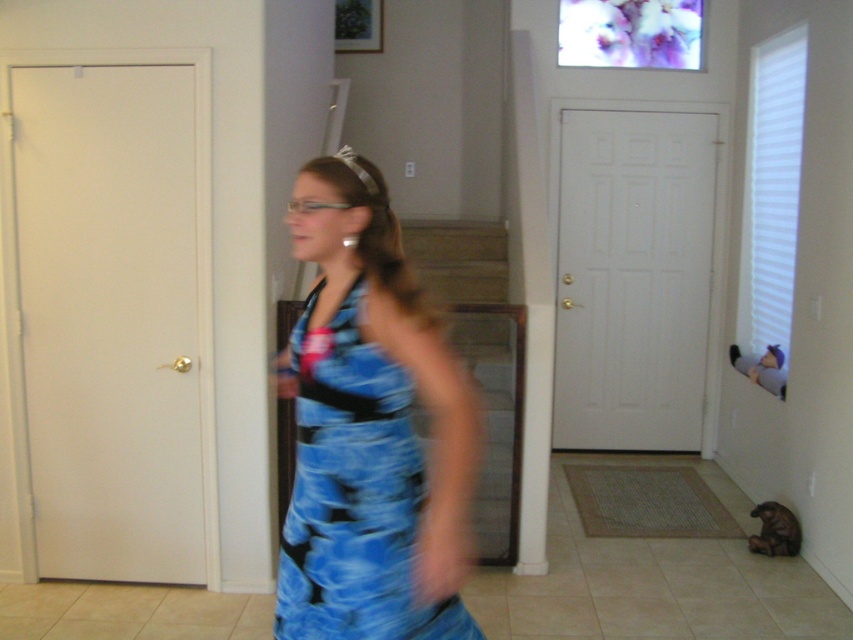
How distant is blue printed fabric dress at center from silver metallic tiara at upper center?

The distance of blue printed fabric dress at center from silver metallic tiara at upper center is 3.73 meters.

Between point (329, 458) and point (346, 164), which one is positioned behind?

Positioned behind is point (346, 164).

Image resolution: width=853 pixels, height=640 pixels. Describe the element at coordinates (354, 493) in the screenshot. I see `blue printed fabric dress at center` at that location.

Where is `blue printed fabric dress at center`? The image size is (853, 640). blue printed fabric dress at center is located at coordinates (354, 493).